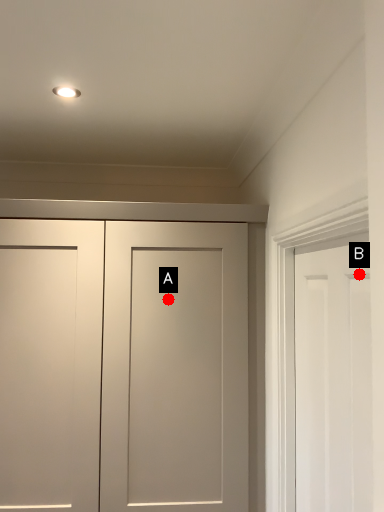
Question: Two points are circled on the image, labeled by A and B beside each circle. Which point is farther to the camera?

Choices:
 (A) A is further
 (B) B is further

Answer: (A)